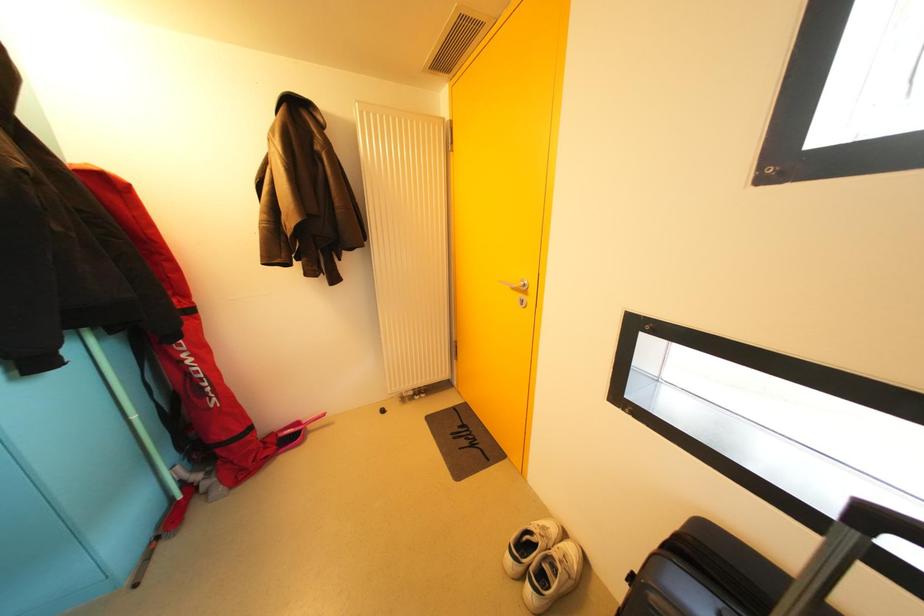
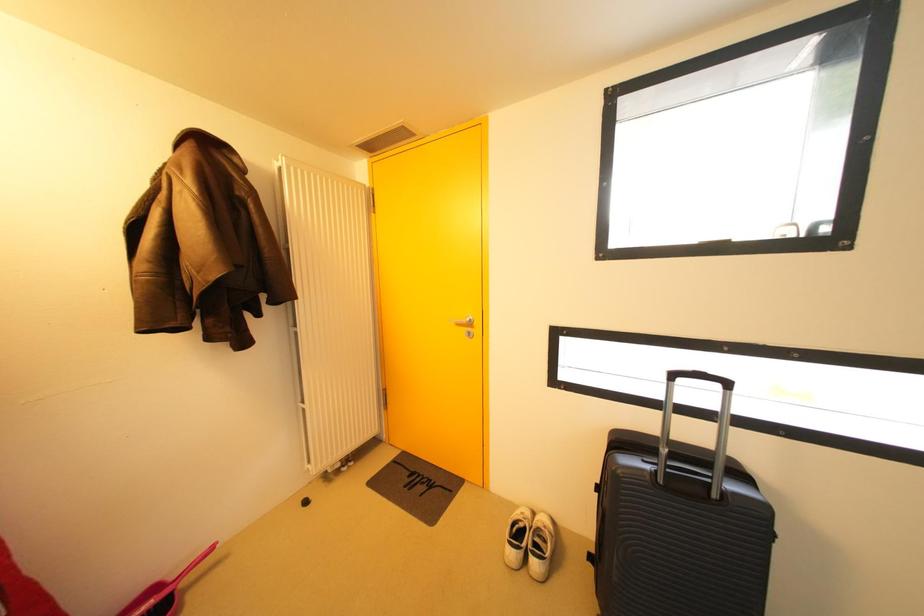
Question: The first image is from the beginning of the video and the second image is from the end. How did the camera likely rotate when shooting the video?

Choices:
 (A) Left
 (B) Right
 (C) Up
 (D) Down

Answer: (B)